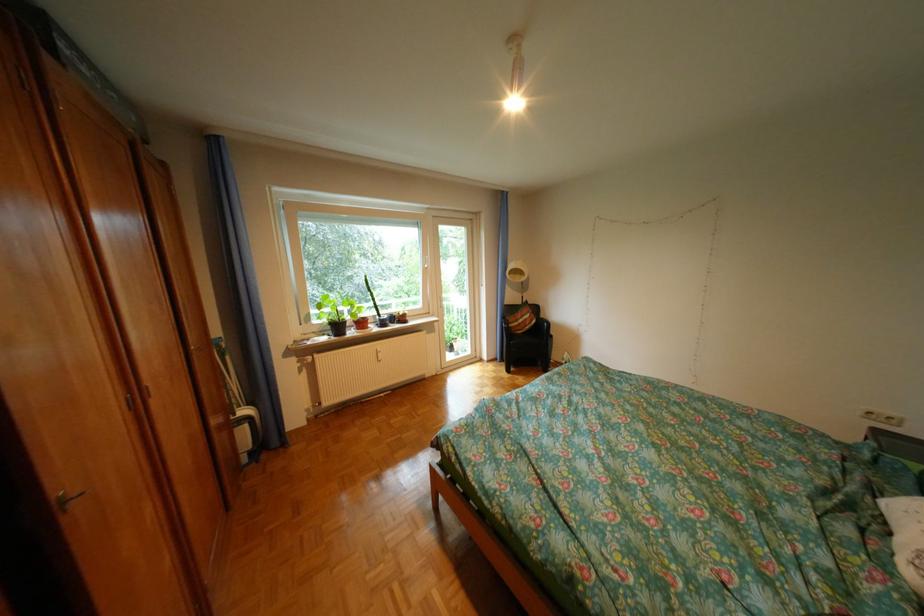
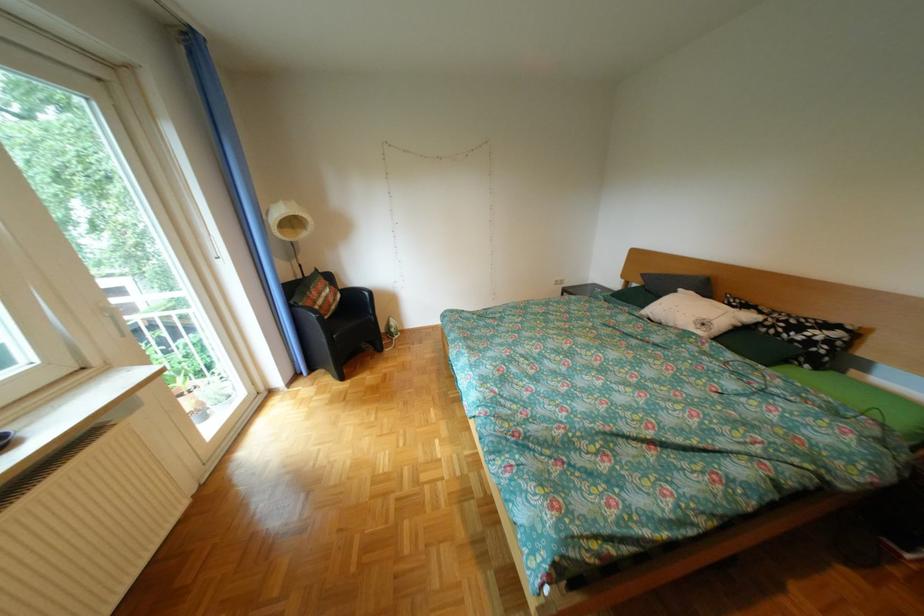
In the second image, find the point that corresponds to (x=517, y=318) in the first image.

(306, 307)